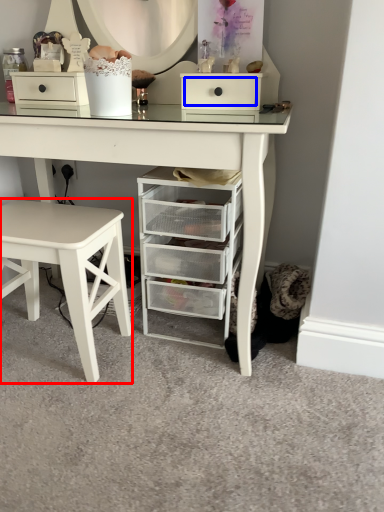
Question: Which point is closer to the camera, stool (highlighted by a red box) or drawer (highlighted by a blue box)?

Choices:
 (A) stool
 (B) drawer

Answer: (A)